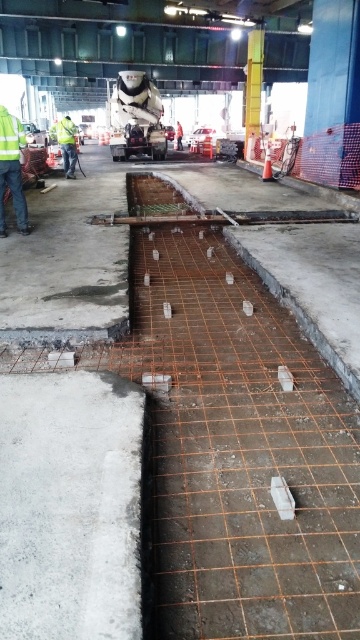
Question: Can you confirm if white smooth concrete at lower left is smaller than high visibility yellow jacket at left?

Choices:
 (A) yes
 (B) no

Answer: (A)

Question: Among these objects, which one is nearest to the camera?

Choices:
 (A) high visibility yellow jacket at left
 (B) white smooth concrete at lower left

Answer: (B)

Question: Which point is farther from the camera taking this photo?

Choices:
 (A) (20, 392)
 (B) (72, 122)

Answer: (B)

Question: Is white smooth concrete at lower left closer to the viewer compared to high visibility yellow jacket at left?

Choices:
 (A) yes
 (B) no

Answer: (A)

Question: Which point is farther to the camera?

Choices:
 (A) white smooth concrete at lower left
 (B) high visibility yellow jacket at left

Answer: (B)

Question: Is white smooth concrete at lower left thinner than high visibility yellow jacket at left?

Choices:
 (A) no
 (B) yes

Answer: (B)